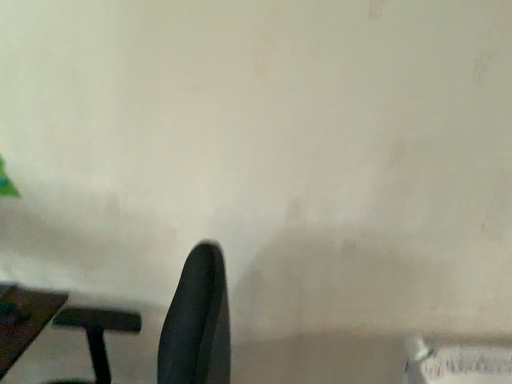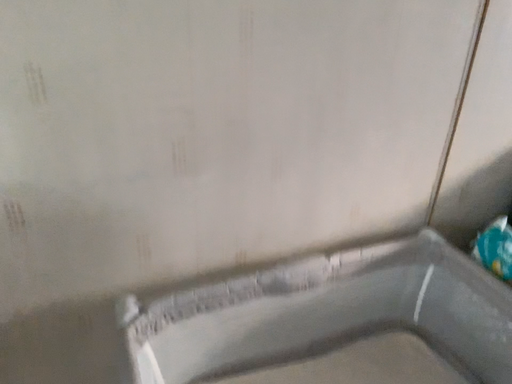
Question: Which way did the camera rotate in the video?

Choices:
 (A) rotated right
 (B) rotated left

Answer: (A)